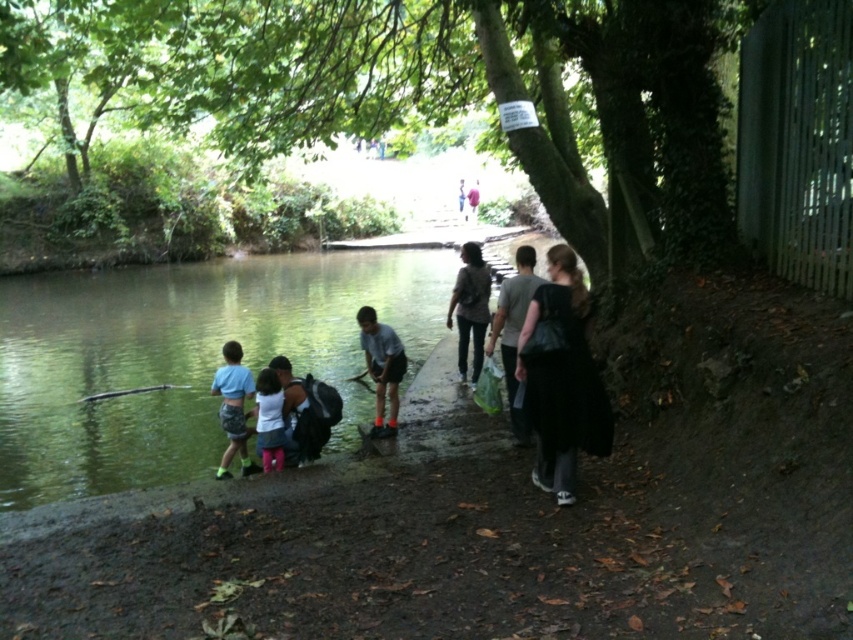
Question: Which point is farther to the camera?

Choices:
 (A) pink fabric pants at lower center
 (B) black fabric dress at right
 (C) camouflage shorts at lower left

Answer: (C)

Question: Is black fabric dress at right positioned at the back of light blue fabric shirt at center?

Choices:
 (A) yes
 (B) no

Answer: (B)

Question: Which point is closer to the camera taking this photo?

Choices:
 (A) (479, 268)
 (B) (270, 410)
 (C) (370, 323)

Answer: (B)

Question: Is dark gray fabric shirt at center further to camera compared to light blue fabric shirt at center?

Choices:
 (A) no
 (B) yes

Answer: (B)

Question: Can you confirm if green smooth water at lower left is positioned to the right of camouflage shorts at lower left?

Choices:
 (A) yes
 (B) no

Answer: (B)

Question: Which object is the farthest from the black fabric dress at right?

Choices:
 (A) pink fabric pants at lower center
 (B) dark gray fabric shirt at center
 (C) green smooth water at lower left

Answer: (C)